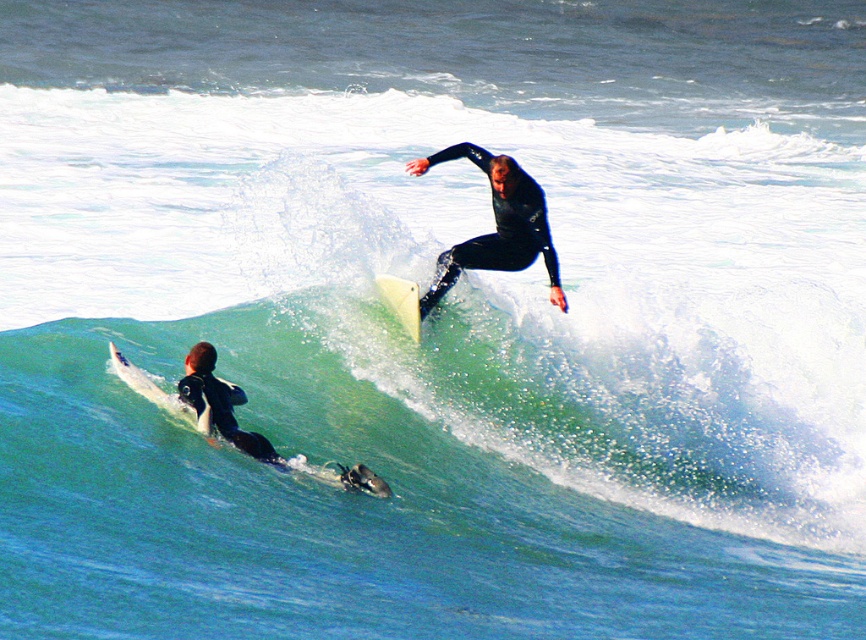
You are a photographer trying to capture the surfer on the white smooth surfboard at center. Since the green rubber wave at center is blocking your view, can you move to the left to get a clearer shot?

The white smooth surfboard at center is behind the green rubber wave at center, so moving to the left might allow you to see around the wave and get a clearer shot of the surfer on the white smooth surfboard at center.

You are a photographer on a boat trying to capture the perfect shot of the black wetsuit surfer at lower left and the white smooth surfboard at center. Based on their positions, which object should you adjust your camera to focus on first to ensure both are in frame?

The black wetsuit surfer at lower left is to the left of the white smooth surfboard at center, so you should focus on the white smooth surfboard at center first to ensure both are in frame.

You are a photographer positioned on a boat 10 meters away from the green rubber wave at center. You want to capture a closeup shot of the wave. Do you need to move closer or farther away?

The green rubber wave at center is 11.80 meters away from the camera. Since you are currently 10 meters away, you need to move 1.8 meters farther away to match the distance for a closeup shot.